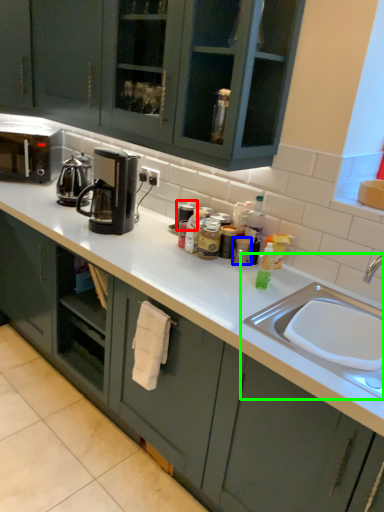
Question: Which object is positioned farthest from appliance (highlighted by a red box)? Select from appliance (highlighted by a blue box) and sink (highlighted by a green box).

Choices:
 (A) appliance
 (B) sink

Answer: (B)